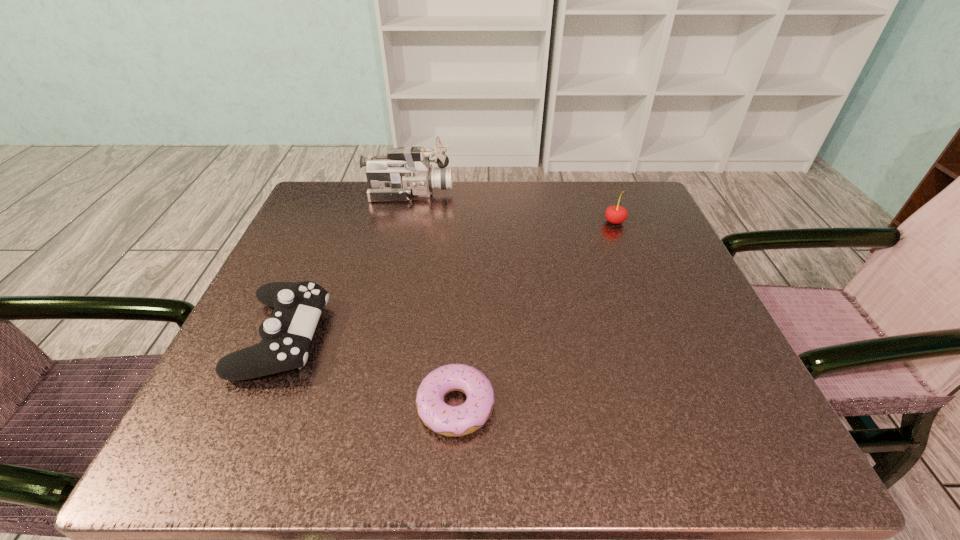
At what (x,y) coordinates should I click in order to perform the action: click on vacant space that satisfies the following two spatial constraints: 1. on the front-facing side of the farthest object; 2. on the right side of the rightmost object. Please return your answer as a coordinate pair (x, y). Looking at the image, I should click on (403, 222).

What are the coordinates of `free space that satisfies the following two spatial constraints: 1. on the front-facing side of the doughnut; 2. on the right side of the camcorder` in the screenshot? It's located at [x=362, y=405].

What are the coordinates of `free space that satisfies the following two spatial constraints: 1. on the front-facing side of the camcorder; 2. on the right side of the rightmost object` in the screenshot? It's located at (403, 222).

The height and width of the screenshot is (540, 960). In order to click on vacant position in the image that satisfies the following two spatial constraints: 1. on the front-facing side of the shortest object; 2. on the left side of the farthest object in this screenshot , I will do click(362, 405).

Locate an element on the screen. free spot that satisfies the following two spatial constraints: 1. on the front side of the second tallest object; 2. on the surface of the control is located at coordinates (660, 336).